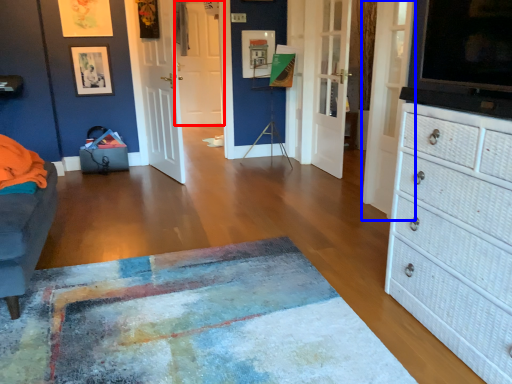
Question: Among these objects, which one is nearest to the camera, door (highlighted by a red box) or door (highlighted by a blue box)?

Choices:
 (A) door
 (B) door

Answer: (B)